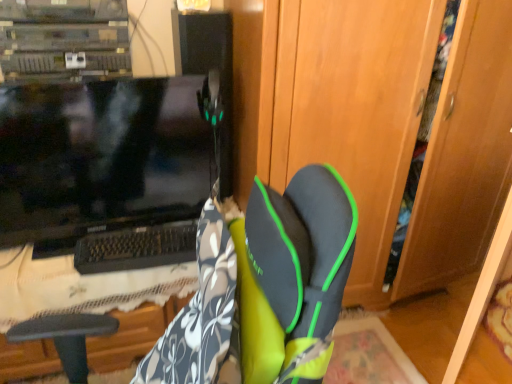
Describe the element at coordinates (99, 156) in the screenshot. I see `black glossy monitor at left` at that location.

Identify the location of black glossy monitor at left. (99, 156).

What is the approximate height of black glossy monitor at left?

64.44 centimeters.

What is the approximate width of black glossy monitor at left?

It is 2.37 inches.

The image size is (512, 384). I want to click on wooden dresser at center, so click(381, 123).

Describe the element at coordinates (381, 123) in the screenshot. I see `wooden dresser at center` at that location.

Measure the distance between point (471, 236) and camera.

The depth of point (471, 236) is 6.97 feet.

I want to click on black glossy monitor at left, so click(99, 156).

Based on the photo, which object is positioned more to the left, wooden dresser at center or black glossy monitor at left?

From the viewer's perspective, black glossy monitor at left appears more on the left side.

Which is behind, wooden dresser at center or black glossy monitor at left?

Positioned behind is black glossy monitor at left.

Is point (337, 11) positioned before point (139, 130)?

Yes, point (337, 11) is closer to viewer.

From the image's perspective, is wooden dresser at center below black glossy monitor at left?

Incorrect, from the image's perspective, wooden dresser at center is higher than black glossy monitor at left.

From a real-world perspective, is wooden dresser at center positioned over black glossy monitor at left based on gravity?

No, from a real-world perspective, wooden dresser at center is not above black glossy monitor at left.

Based on the photo, considering the sizes of objects wooden dresser at center and black glossy monitor at left in the image provided, who is thinner, wooden dresser at center or black glossy monitor at left?

With smaller width is black glossy monitor at left.

Considering the sizes of wooden dresser at center and black glossy monitor at left in the image, is wooden dresser at center taller or shorter than black glossy monitor at left?

Considering their sizes, wooden dresser at center has more height than black glossy monitor at left.

Who is bigger, wooden dresser at center or black glossy monitor at left?

wooden dresser at center is bigger.

Is black glossy monitor at left surrounded by wooden dresser at center?

No, black glossy monitor at left is not a part of wooden dresser at center.

Is wooden dresser at center positioned far away from black glossy monitor at left?

wooden dresser at center is actually quite close to black glossy monitor at left.

Is wooden dresser at center positioned with its back to black glossy monitor at left?

That's not correct — wooden dresser at center is not looking away from black glossy monitor at left.

Can you tell me how much wooden dresser at center and black glossy monitor at left differ in facing direction?

They differ by 1.23 degrees in their facing directions.

I want to click on dresser above the black glossy monitor at left (from the image's perspective), so click(381, 123).

Is black glossy monitor at left at the right side of wooden dresser at center?

In fact, black glossy monitor at left is to the left of wooden dresser at center.

Who is more distant, black glossy monitor at left or wooden dresser at center?

Positioned behind is black glossy monitor at left.

Is point (88, 104) positioned behind point (364, 27)?

Yes, it is behind point (364, 27).

From the image's perspective, would you say black glossy monitor at left is positioned over wooden dresser at center?

Actually, black glossy monitor at left appears below wooden dresser at center in the image.

From a real-world perspective, which is physically above, black glossy monitor at left or wooden dresser at center?

black glossy monitor at left, from a real-world perspective.

Considering the relative sizes of black glossy monitor at left and wooden dresser at center in the image provided, is black glossy monitor at left thinner than wooden dresser at center?

Indeed, black glossy monitor at left has a lesser width compared to wooden dresser at center.

Does black glossy monitor at left have a greater height compared to wooden dresser at center?

In fact, black glossy monitor at left may be shorter than wooden dresser at center.

Which of these two, black glossy monitor at left or wooden dresser at center, is bigger?

Bigger between the two is wooden dresser at center.

Based on the photo, choose the correct answer: Is black glossy monitor at left inside wooden dresser at center or outside it?

black glossy monitor at left is outside wooden dresser at center.

Is black glossy monitor at left beside wooden dresser at center?

No, black glossy monitor at left is not making contact with wooden dresser at center.

Is black glossy monitor at left looking in the opposite direction of wooden dresser at center?

No.

Measure the distance from black glossy monitor at left to wooden dresser at center.

black glossy monitor at left is 65.99 centimeters from wooden dresser at center.

The image size is (512, 384). I want to click on computer monitor on the left of wooden dresser at center, so click(x=99, y=156).

Identify the location of dresser that is above the black glossy monitor at left (from the image's perspective). tap(381, 123).

This screenshot has height=384, width=512. In order to click on computer monitor positioned vertically above the wooden dresser at center (from a real-world perspective) in this screenshot , I will do `click(99, 156)`.